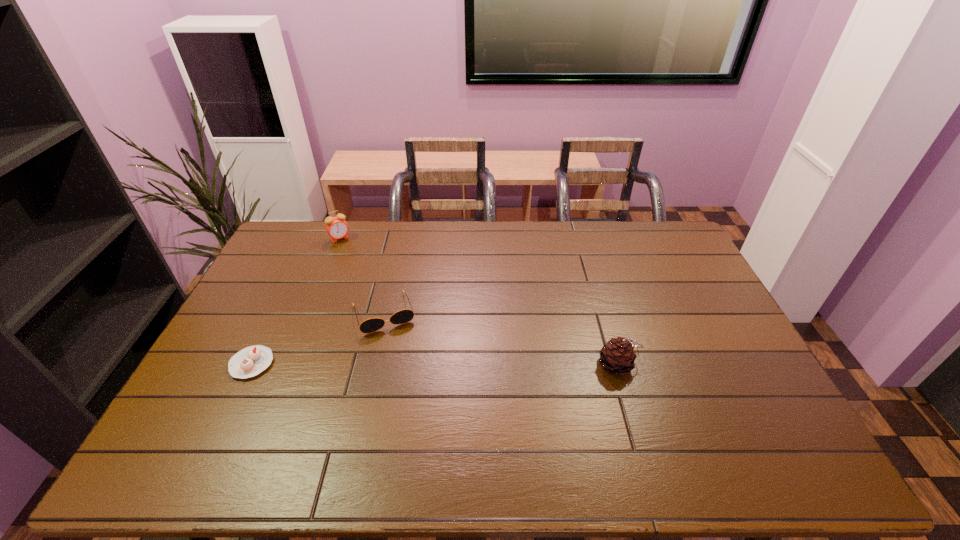
Where is `free space between the leftmost object and the pinecone`? Image resolution: width=960 pixels, height=540 pixels. free space between the leftmost object and the pinecone is located at coordinates (436, 364).

Where is `vacant region between the rightmost object and the cupcake`? vacant region between the rightmost object and the cupcake is located at coordinates (436, 364).

Choose which object is the third nearest neighbor to the third nearest object. Please provide its 2D coordinates. Your answer should be formatted as a tuple, i.e. [(x, y)], where the tuple contains the x and y coordinates of a point satisfying the conditions above.

[(617, 356)]

Select which object is the third closest to the leftmost object. Please provide its 2D coordinates. Your answer should be formatted as a tuple, i.e. [(x, y)], where the tuple contains the x and y coordinates of a point satisfying the conditions above.

[(617, 356)]

This screenshot has width=960, height=540. In order to click on vacant space that satisfies the following two spatial constraints: 1. on the front side of the farthest object; 2. with a leaf charm attached to the pinecone in this screenshot , I will do `click(289, 364)`.

The height and width of the screenshot is (540, 960). Identify the location of free point that satisfies the following two spatial constraints: 1. on the front side of the cupcake; 2. with a leaf charm attached to the rightmost object. (251, 364).

You are a GUI agent. You are given a task and a screenshot of the screen. Output one action in this format:
    pyautogui.click(x=<x>, y=<y>)
    Task: Click on the free space that satisfies the following two spatial constraints: 1. on the front side of the pinecone; 2. with a leaf charm attached to the leftmost object
    This screenshot has height=540, width=960.
    Given the screenshot: What is the action you would take?
    pyautogui.click(x=251, y=364)

Where is `vacant region that satisfies the following two spatial constraints: 1. on the front side of the sunglasses; 2. with a leaf charm attached to the rightmost object`? The image size is (960, 540). vacant region that satisfies the following two spatial constraints: 1. on the front side of the sunglasses; 2. with a leaf charm attached to the rightmost object is located at coordinates (372, 364).

At what (x,y) coordinates should I click in order to perform the action: click on vacant point that satisfies the following two spatial constraints: 1. on the back side of the leftmost object; 2. on the left side of the second object from right to left. Please return your answer as a coordinate pair (x, y). The height and width of the screenshot is (540, 960). Looking at the image, I should click on (276, 313).